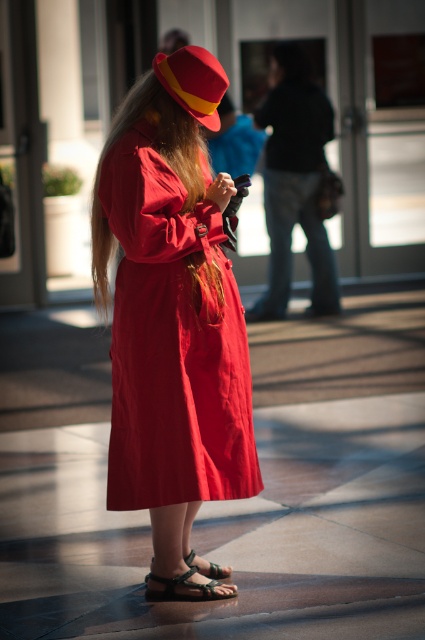
You are a fashion designer observing a model wearing the matte red dress at center and shiny golden hair at center. Which of the two has a greater width?

The matte red dress at center has a greater width than the shiny golden hair at center.

You are a fashion designer observing this person. You need to determine if their shiny golden hair at center can be seen from the green leather sandal at lower center. Based on the spatial relationship between these two items, what is your conclusion?

The shiny golden hair at center is 6.40 feet away from the green leather sandal at lower center. Since the hair is significantly taller than the sandal and positioned above it, the hair would be visible from the sandal.